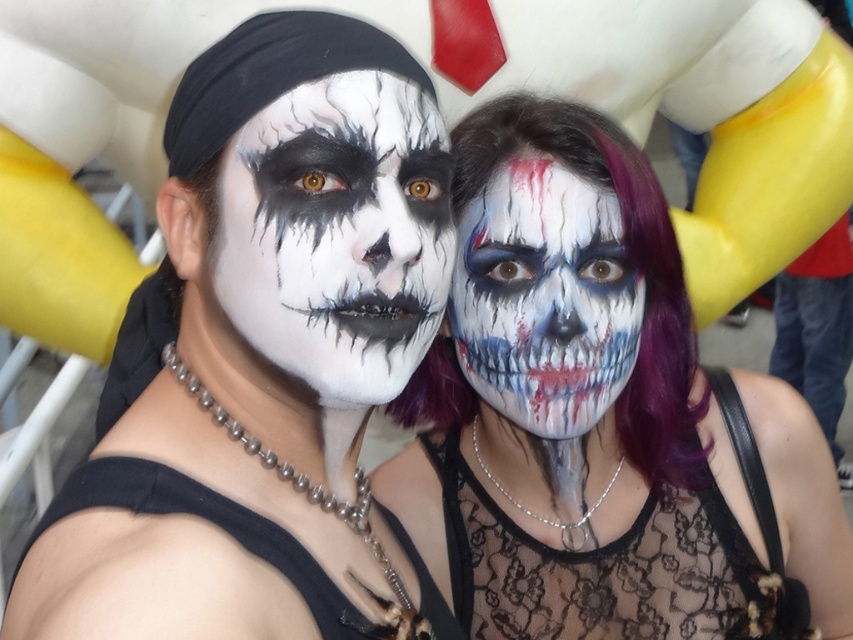
Which is more to the right, matte black skull at center or matte white skull at center?

matte white skull at center is more to the right.

Where is `matte black skull at center`? This screenshot has width=853, height=640. matte black skull at center is located at coordinates (337, 234).

Does point (260, 232) lie behind point (460, 244)?

No, it is not.

Locate an element on the screen. The image size is (853, 640). matte black skull at center is located at coordinates (337, 234).

Looking at this image, measure the distance from blood-stained lace dress at center to matte white skull at center.

7.68 inches

Find the location of a particular element. blood-stained lace dress at center is located at coordinates (625, 560).

Is point (744, 419) positioned in front of point (537, 237)?

No, (744, 419) is further to viewer.

This screenshot has width=853, height=640. Find the location of `blood-stained lace dress at center`. blood-stained lace dress at center is located at coordinates (625, 560).

Which is in front, point (671, 348) or point (282, 358)?

Positioned in front is point (282, 358).

Does matte white face paint at center have a lesser height compared to matte black skull at center?

In fact, matte white face paint at center may be taller than matte black skull at center.

Is point (718, 493) less distant than point (283, 147)?

No, (718, 493) is further to viewer.

This screenshot has width=853, height=640. Identify the location of matte white face paint at center. (601, 417).